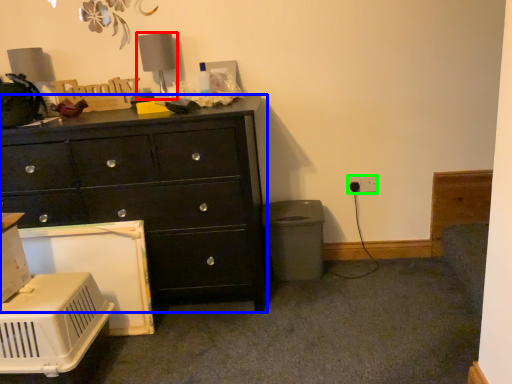
Question: Estimate the real-world distances between objects in this image. Which object is closer to table lamp (highlighted by a red box), chest of drawers (highlighted by a blue box) or electric outlet (highlighted by a green box)?

Choices:
 (A) chest of drawers
 (B) electric outlet

Answer: (A)